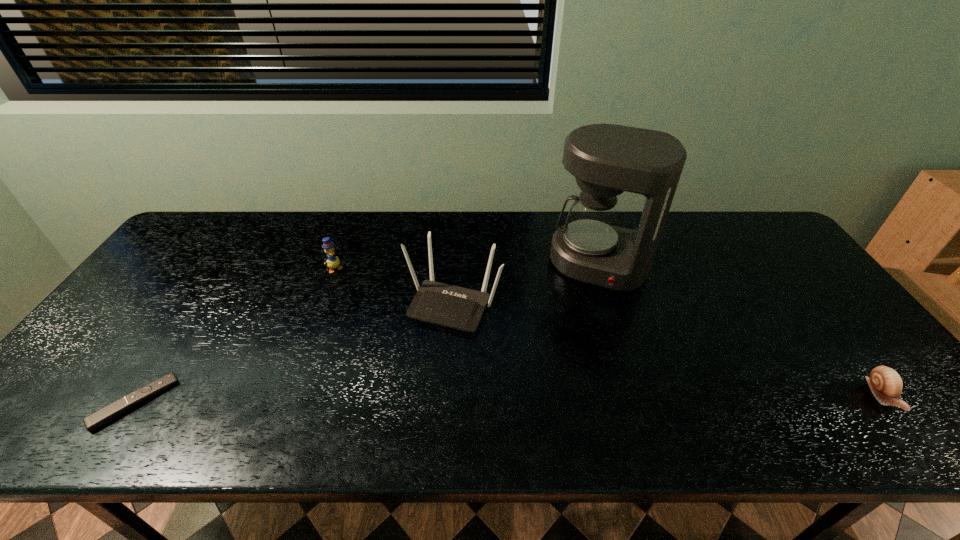
Where is `the shortest object`? The image size is (960, 540). the shortest object is located at coordinates (106, 414).

At what (x,y) coordinates should I click in order to perform the action: click on remote control. Please return your answer as a coordinate pair (x, y). This screenshot has width=960, height=540. Looking at the image, I should click on (106, 414).

What are the coordinates of `the rightmost object` in the screenshot? It's located at (885, 383).

The width and height of the screenshot is (960, 540). What are the coordinates of `escargot` in the screenshot? It's located at (885, 383).

This screenshot has width=960, height=540. I want to click on the third shortest object, so click(333, 262).

Find the location of a particular element. The image size is (960, 540). the second object from left to right is located at coordinates (333, 262).

Image resolution: width=960 pixels, height=540 pixels. I want to click on the tallest object, so click(x=606, y=159).

Where is `the fourth object from left to right`? the fourth object from left to right is located at coordinates (606, 159).

Locate an element on the screen. the second tallest object is located at coordinates (443, 304).

What are the coordinates of `router` in the screenshot? It's located at (443, 304).